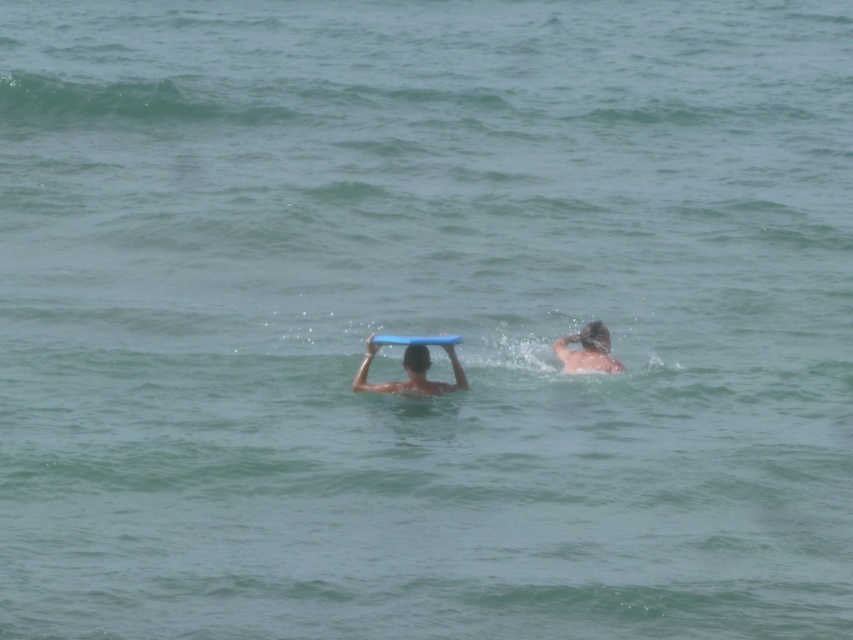
Can you confirm if blue matte surfboard at center is thinner than blue foam surfboard at center?

No, blue matte surfboard at center is not thinner than blue foam surfboard at center.

Is blue matte surfboard at center positioned at the back of blue foam surfboard at center?

Yes, it is behind blue foam surfboard at center.

Identify the location of blue matte surfboard at center. (410, 371).

Image resolution: width=853 pixels, height=640 pixels. Find the location of `blue matte surfboard at center`. blue matte surfboard at center is located at coordinates (410, 371).

Does smooth skin head at upper center have a smaller size compared to blue foam surfboard at center?

No, smooth skin head at upper center is not smaller than blue foam surfboard at center.

Can you confirm if smooth skin head at upper center is positioned above blue foam surfboard at center?

Actually, smooth skin head at upper center is below blue foam surfboard at center.

Is point (582, 356) in front of point (438, 339)?

No, it is not.

Where is `smooth skin head at upper center`? The image size is (853, 640). smooth skin head at upper center is located at coordinates (587, 349).

Is point (450, 385) behind point (579, 332)?

That is False.

At what (x,y) coordinates should I click in order to perform the action: click on blue matte surfboard at center. Please return your answer as a coordinate pair (x, y). This screenshot has width=853, height=640. Looking at the image, I should click on coord(410,371).